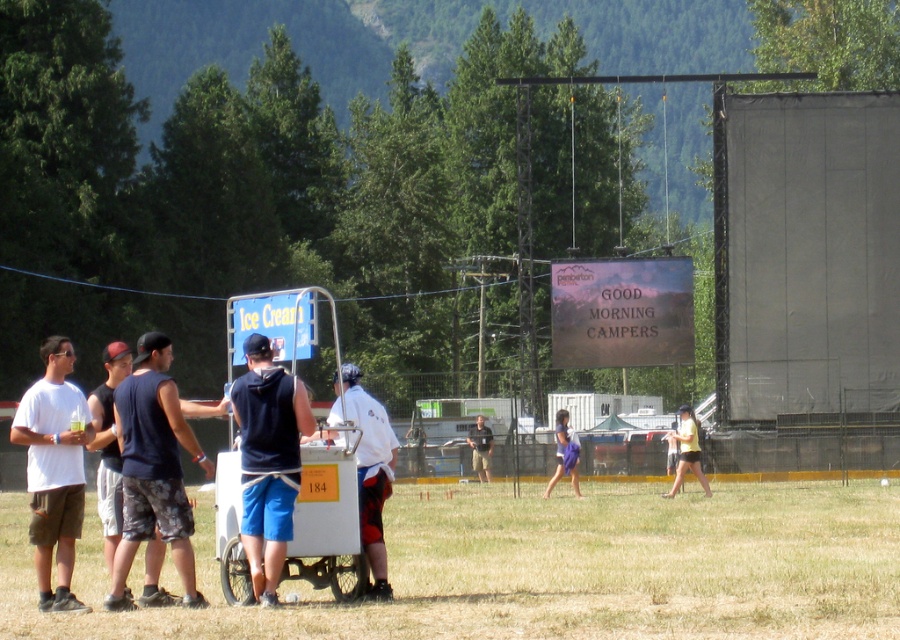
You are standing at the entrance of the festival and want to buy ice cream. The entrance is at point 0.0. Where should you go to find the white plastic cart at lower center?

The white plastic cart at lower center is located at point [545,568], so you should head towards that coordinate to find it.

You are standing at the festival and see the white plastic cart at lower center. What object is exactly at the coordinate point [545,568]?

The point [545,568] indicates the white plastic cart at lower center.

Based on the photo, you are planning to place a small table between the white plastic cart at lower center and the dark blue fabric hoodie at center. Which object should the table be closer to to ensure it fits within the space?

The table should be placed closer to the dark blue fabric hoodie at center because the white plastic cart at lower center is wider, leaving less space on its side for the table.